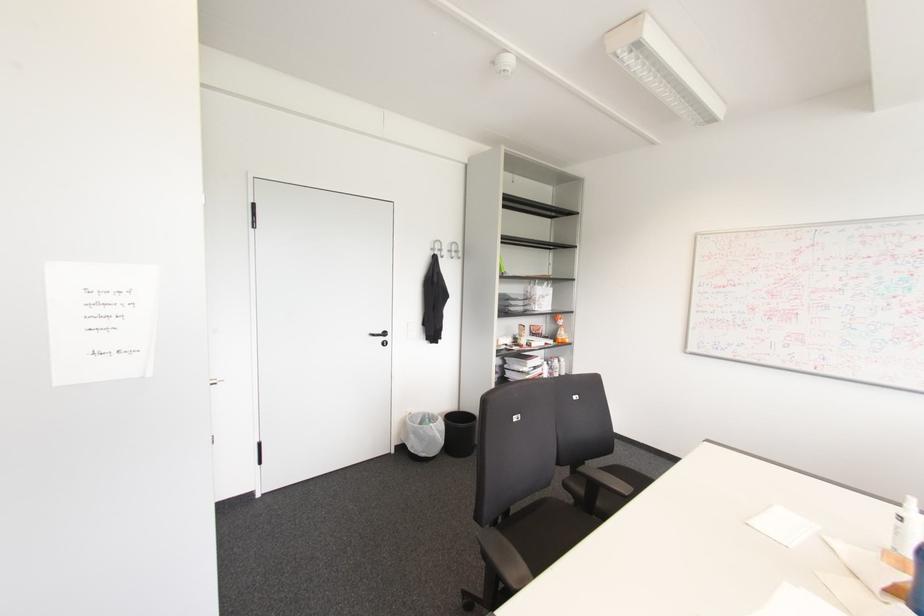
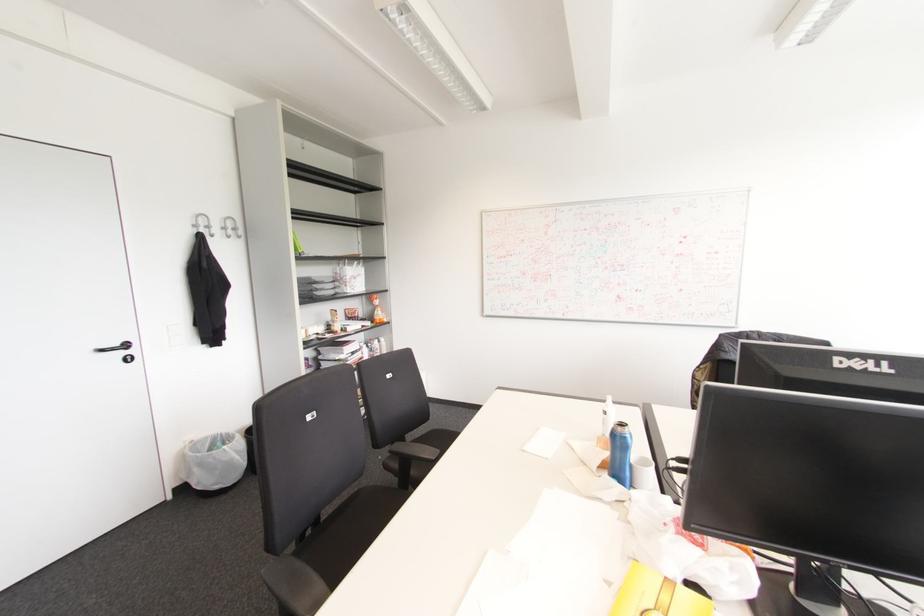
The point at [456,251] is marked in the first image. Where is the corresponding point in the second image?

(234, 229)